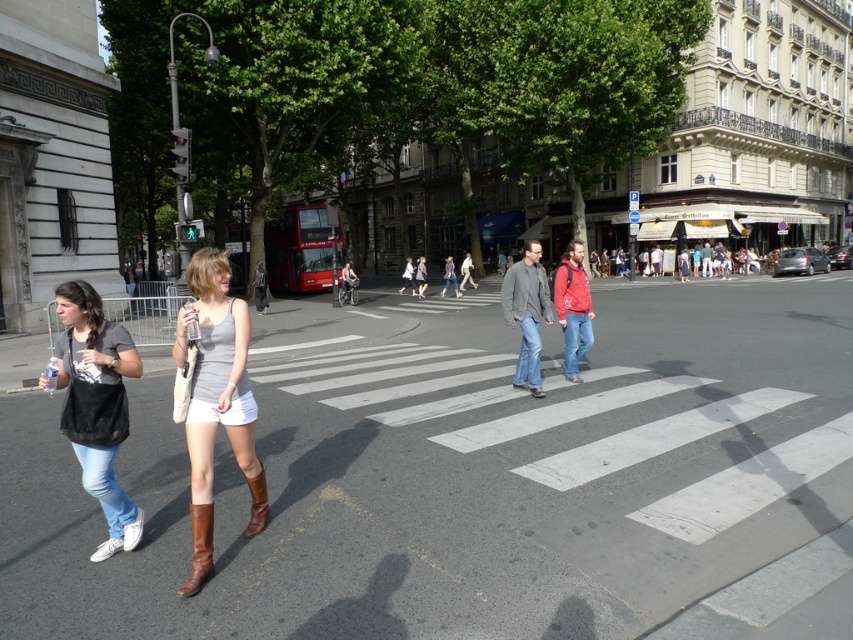
Question: Where is brown leather boot at lower left located in relation to brown leather boot at lower center in the image?

Choices:
 (A) right
 (B) left

Answer: (B)

Question: Is gray matte tank top at center wider than brown leather boot at lower left?

Choices:
 (A) no
 (B) yes

Answer: (B)

Question: Which of these objects is positioned farthest from the brown leather boot at lower center?

Choices:
 (A) brown leather boot at lower left
 (B) matte black bag at left

Answer: (B)

Question: Can you confirm if gray matte tank top at center is positioned to the right of brown leather boot at lower left?

Choices:
 (A) no
 (B) yes

Answer: (A)

Question: Which object appears closest to the camera in this image?

Choices:
 (A) gray matte tank top at center
 (B) brown leather boot at lower center

Answer: (A)

Question: Which of the following is the closest to the observer?

Choices:
 (A) gray matte tank top at center
 (B) brown leather boot at lower center
 (C) brown leather boot at lower left

Answer: (C)